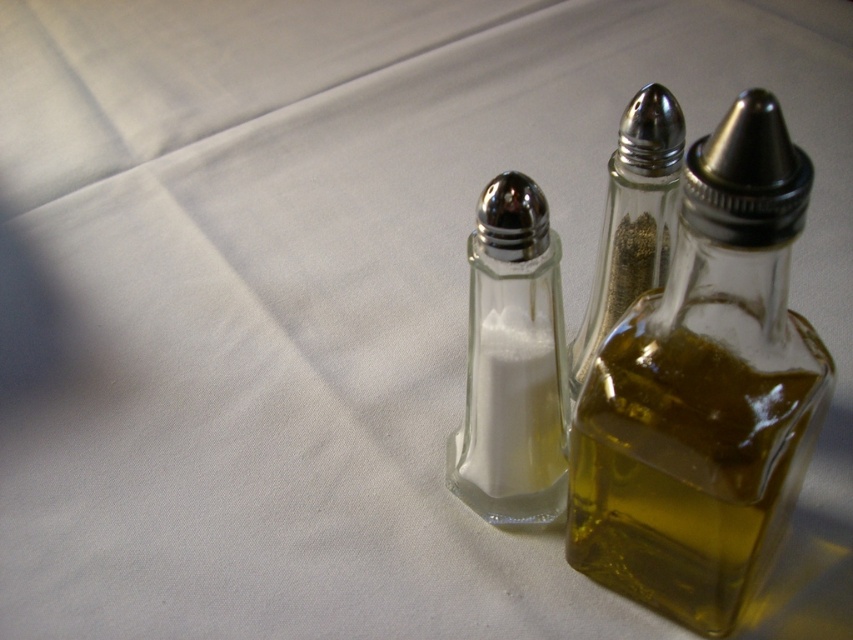
Is transparent glass bottle at center above clear glass pepper grinder at center?

No, transparent glass bottle at center is not above clear glass pepper grinder at center.

Can you confirm if transparent glass bottle at center is shorter than clear glass pepper grinder at center?

Incorrect, transparent glass bottle at center's height does not fall short of clear glass pepper grinder at center's.

The width and height of the screenshot is (853, 640). I want to click on transparent glass bottle at center, so click(705, 390).

Where is `transparent glass bottle at center`? transparent glass bottle at center is located at coordinates (705, 390).

Between transparent glass bottle at center and clear glass salt shaker at center, which one has less height?

With less height is clear glass salt shaker at center.

Does transparent glass bottle at center have a smaller size compared to clear glass salt shaker at center?

Incorrect, transparent glass bottle at center is not smaller in size than clear glass salt shaker at center.

At what (x,y) coordinates should I click in order to perform the action: click on transparent glass bottle at center. Please return your answer as a coordinate pair (x, y). The height and width of the screenshot is (640, 853). Looking at the image, I should click on (705, 390).

Find the location of a particular element. The width and height of the screenshot is (853, 640). transparent glass bottle at center is located at coordinates (705, 390).

At what (x,y) coordinates should I click in order to perform the action: click on clear glass salt shaker at center. Please return your answer as a coordinate pair (x, y). The image size is (853, 640). Looking at the image, I should click on (512, 362).

I want to click on clear glass salt shaker at center, so click(512, 362).